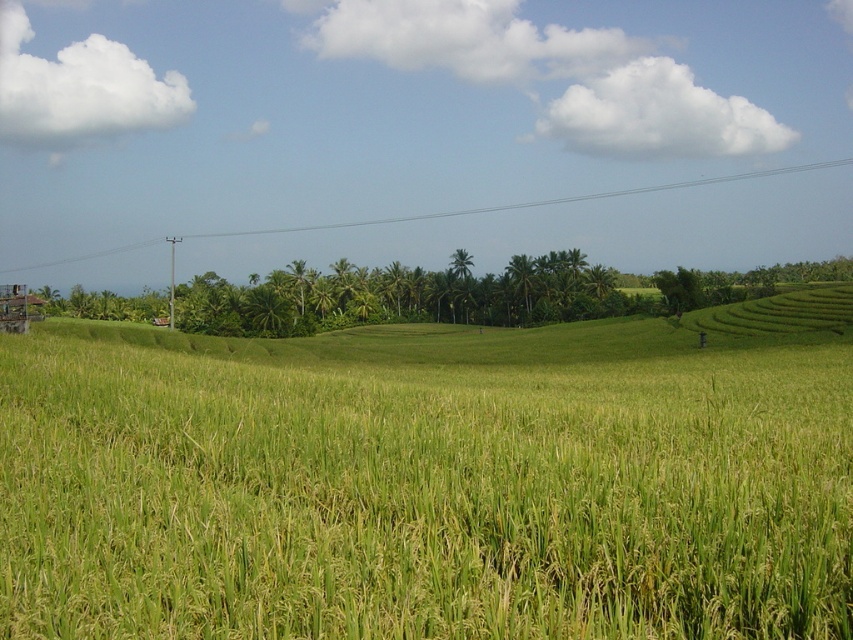
Question: Among these points, which one is nearest to the camera?

Choices:
 (A) (335, 440)
 (B) (300, 225)

Answer: (A)

Question: Considering the relative positions of green grassy field at center and clear plastic power line at upper center in the image provided, where is green grassy field at center located with respect to clear plastic power line at upper center?

Choices:
 (A) right
 (B) left

Answer: (A)

Question: Does green grassy field at center lie behind clear plastic power line at upper center?

Choices:
 (A) yes
 (B) no

Answer: (B)

Question: Among these points, which one is farthest from the camera?

Choices:
 (A) (403, 218)
 (B) (628, 403)

Answer: (A)

Question: Is green grassy field at center bigger than clear plastic power line at upper center?

Choices:
 (A) no
 (B) yes

Answer: (A)